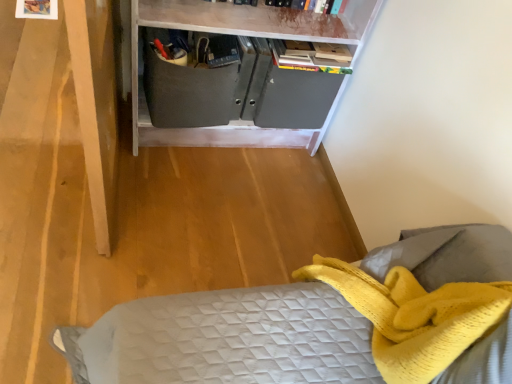
Where is `free space in front of matte gray cabinet at center`? The image size is (512, 384). free space in front of matte gray cabinet at center is located at coordinates pos(193,214).